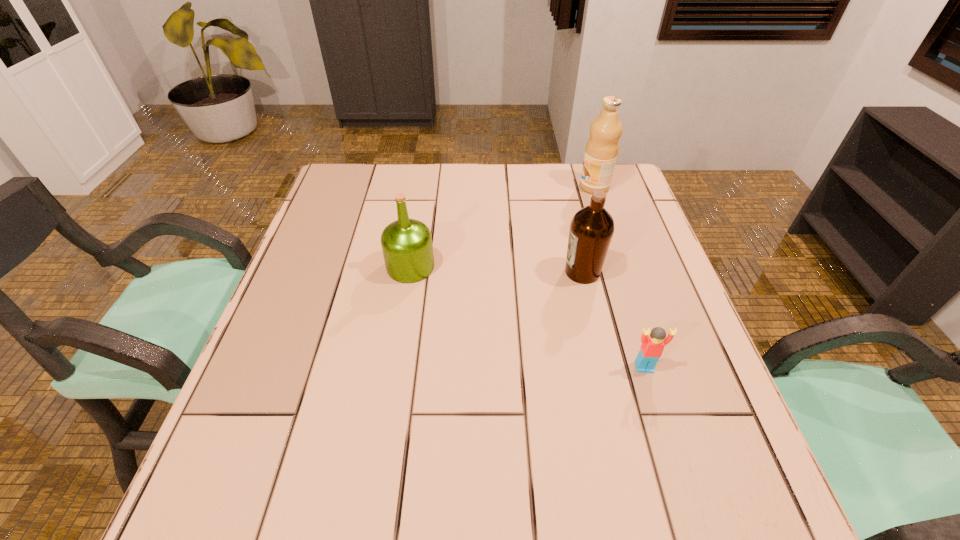
Identify the location of vacant region between the nearest object and the third object from right to left. (613, 320).

Where is `object that can be found as the third closest to the farthest olive oil`? object that can be found as the third closest to the farthest olive oil is located at coordinates (652, 346).

Identify which object is the third nearest to the rightmost olive oil. Please provide its 2D coordinates. Your answer should be formatted as a tuple, i.e. [(x, y)], where the tuple contains the x and y coordinates of a point satisfying the conditions above.

[(652, 346)]

Identify the location of olive oil that stands as the closest to the second olive oil from left to right. The width and height of the screenshot is (960, 540). (602, 148).

This screenshot has height=540, width=960. I want to click on the closest olive oil to the Lego, so click(x=591, y=230).

This screenshot has width=960, height=540. What are the coordinates of `free spot that satisfies the following two spatial constraints: 1. on the label of the farthest olive oil; 2. on the face of the shortest object` in the screenshot? It's located at (653, 367).

This screenshot has height=540, width=960. I want to click on vacant space that satisfies the following two spatial constraints: 1. on the label of the farthest olive oil; 2. on the face of the Lego, so coord(653,367).